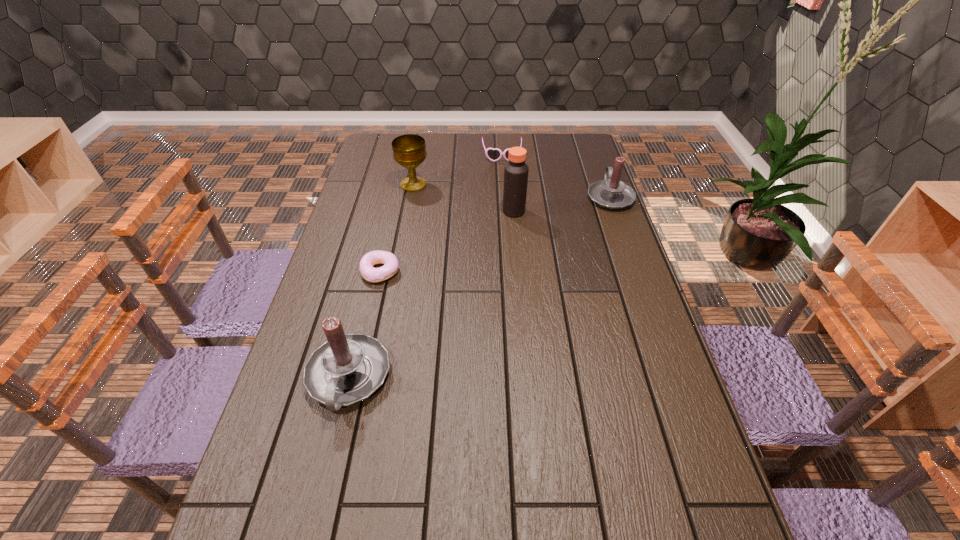
Image resolution: width=960 pixels, height=540 pixels. What are the coordinates of `the nearest object` in the screenshot? It's located at (348, 368).

At what (x,y) coordinates should I click in order to perform the action: click on the taller candle. Please return your answer as a coordinate pair (x, y). This screenshot has width=960, height=540. Looking at the image, I should click on (348, 368).

You are a GUI agent. You are given a task and a screenshot of the screen. Output one action in this format:
    pyautogui.click(x=<x>, y=<y>)
    Task: Click on the rightmost object
    This screenshot has height=540, width=960.
    Given the screenshot: What is the action you would take?
    pyautogui.click(x=611, y=193)

The image size is (960, 540). I want to click on the right candle, so click(x=611, y=193).

Find the location of a particular element. the farthest object is located at coordinates (492, 154).

At what (x,y) coordinates should I click in order to perform the action: click on the second shortest object. Please return your answer as a coordinate pair (x, y). The image size is (960, 540). Looking at the image, I should click on (492, 154).

Locate an element on the screen. chalice is located at coordinates (409, 150).

Find the location of a particular element. This screenshot has height=540, width=960. vinegar is located at coordinates (516, 170).

In order to click on doughnut in this screenshot , I will do `click(390, 268)`.

Image resolution: width=960 pixels, height=540 pixels. I want to click on the second nearest object, so click(x=390, y=268).